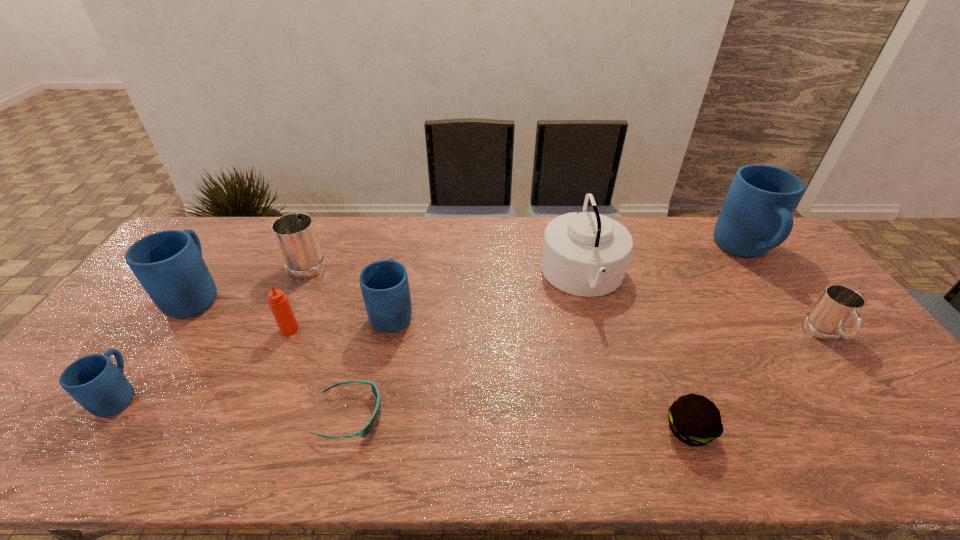
The height and width of the screenshot is (540, 960). In order to click on blank area located on the side of the second biggest blue mug with the handle in this screenshot , I will do `click(247, 221)`.

Identify the location of vacant space located on the side of the second biggest blue mug with the handle. (235, 239).

The width and height of the screenshot is (960, 540). Identify the location of vacant space located on the side of the second biggest blue mug with the handle. (229, 248).

The height and width of the screenshot is (540, 960). Find the location of `vacant space located 0.080m on the side of the fourth mug from right to left with the handle`. vacant space located 0.080m on the side of the fourth mug from right to left with the handle is located at coordinates (323, 231).

I want to click on vacant space located on the side of the third biggest blue mug with the handle, so [x=402, y=264].

The width and height of the screenshot is (960, 540). I want to click on vacant space located on the side of the third biggest blue mug with the handle, so click(x=403, y=260).

At what (x,y) coordinates should I click in order to perform the action: click on blank space located 0.320m on the side of the third biggest blue mug with the handle. Please return your answer as a coordinate pair (x, y). The image size is (960, 540). Looking at the image, I should click on (409, 230).

Image resolution: width=960 pixels, height=540 pixels. I want to click on vacant area situated 0.290m on the right of the Tabasco sauce, so click(400, 329).

Locate an element on the screen. The image size is (960, 540). blank area located on the side of the nearer gray mug with the handle is located at coordinates (906, 442).

Where is `vacant space situated on the side of the nearest mug with the handle`? The image size is (960, 540). vacant space situated on the side of the nearest mug with the handle is located at coordinates (193, 289).